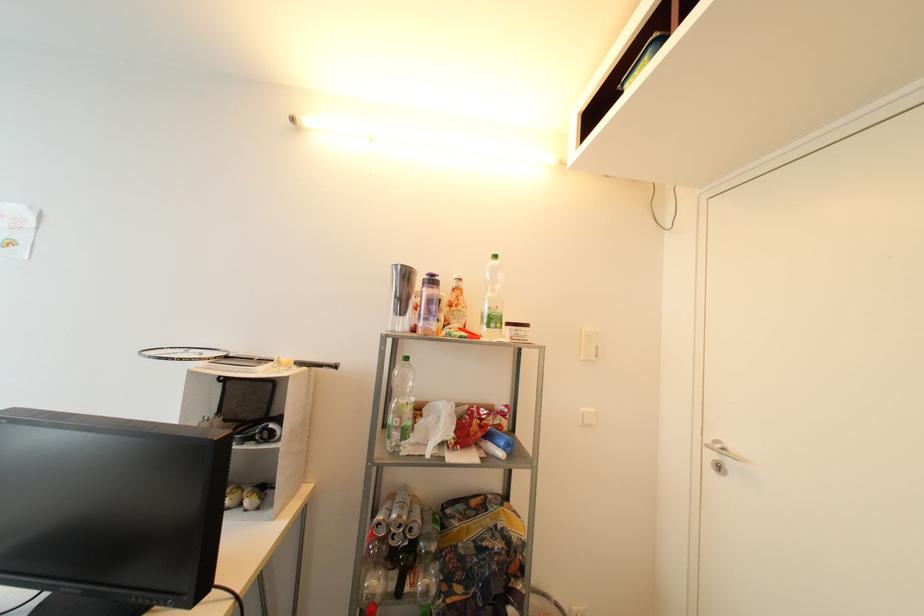
Where would you unscrew the orange label bottle? Please return your answer as a coordinate pair (x, y).

(456, 304)